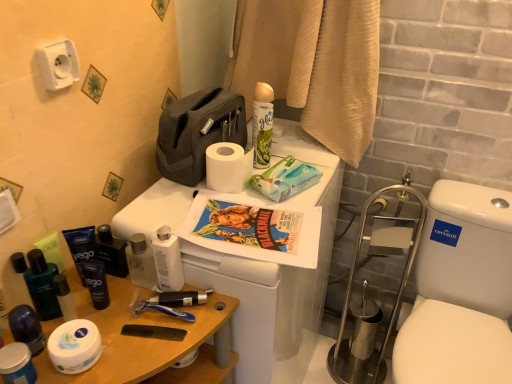
Question: Is dark blue matte tube at left, which ranks as the sixth toiletry in left-to-right order, completely or partially inside white glossy toilet seat at right?

Choices:
 (A) yes
 (B) no

Answer: (B)

Question: Is the position of white glossy toilet seat at right more distant than that of dark blue matte tube at left, which ranks as the sixth toiletry in left-to-right order?

Choices:
 (A) yes
 (B) no

Answer: (B)

Question: From the image's perspective, does white glossy toilet seat at right appear higher than dark blue matte tube at left, which ranks as the sixth toiletry in left-to-right order?

Choices:
 (A) no
 (B) yes

Answer: (A)

Question: Is white glossy toilet seat at right positioned in front of dark blue matte tube at left, which ranks as the sixth toiletry in left-to-right order?

Choices:
 (A) no
 (B) yes

Answer: (B)

Question: Are white glossy toilet seat at right and dark blue matte tube at left, which ranks as the sixth toiletry in left-to-right order, making contact?

Choices:
 (A) yes
 (B) no

Answer: (B)

Question: Based on their positions, is matte black shaving cream at left, positioned as the sixth toiletry in right-to-left order, located to the left or right of white plastic toilet at upper center?

Choices:
 (A) left
 (B) right

Answer: (A)

Question: Is matte black shaving cream at left, positioned as the sixth toiletry in right-to-left order, wider or thinner than white plastic toilet at upper center?

Choices:
 (A) wide
 (B) thin

Answer: (B)

Question: From the image's perspective, is matte black shaving cream at left, positioned as the sixth toiletry in right-to-left order, located above or below white plastic toilet at upper center?

Choices:
 (A) below
 (B) above

Answer: (B)

Question: From a real-world perspective, relative to white plastic toilet at upper center, is matte black shaving cream at left, positioned as the sixth toiletry in right-to-left order, vertically above or below?

Choices:
 (A) below
 (B) above

Answer: (B)

Question: From a real-world perspective, is white paper towels at center physically located above or below matte black shaving cream at left, which appears as the 5th toiletry when viewed from the left?

Choices:
 (A) below
 (B) above

Answer: (B)

Question: Is white paper towels at center bigger or smaller than matte black shaving cream at left, which appears as the 5th toiletry when viewed from the left?

Choices:
 (A) big
 (B) small

Answer: (A)

Question: Is white paper towels at center inside the boundaries of matte black shaving cream at left, which appears as the 5th toiletry when viewed from the left, or outside?

Choices:
 (A) outside
 (B) inside

Answer: (A)

Question: From the image's perspective, relative to matte black shaving cream at left, which is counted as the third toiletry, starting from the right, is white paper towels at center above or below?

Choices:
 (A) above
 (B) below

Answer: (A)

Question: Is shiny black bottles at lower left, marked as the 7th toiletry in a right-to-left arrangement, taller or shorter than wooden table at lower left?

Choices:
 (A) short
 (B) tall

Answer: (A)

Question: Is shiny black bottles at lower left, which appears as the 1th toiletry when viewed from the left, wider or thinner than wooden table at lower left?

Choices:
 (A) wide
 (B) thin

Answer: (B)